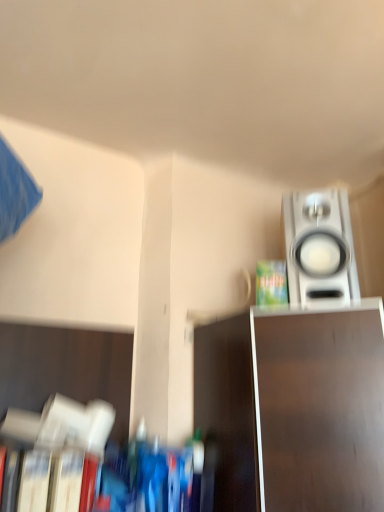
Question: Is green matte paperback book at upper right shorter than metallic silver tv stand at lower right?

Choices:
 (A) yes
 (B) no

Answer: (A)

Question: Is green matte paperback book at upper right taller than metallic silver tv stand at lower right?

Choices:
 (A) no
 (B) yes

Answer: (A)

Question: Is green matte paperback book at upper right not close to metallic silver tv stand at lower right?

Choices:
 (A) yes
 (B) no

Answer: (B)

Question: Is green matte paperback book at upper right closer to camera compared to metallic silver tv stand at lower right?

Choices:
 (A) no
 (B) yes

Answer: (A)

Question: Does green matte paperback book at upper right have a larger size compared to metallic silver tv stand at lower right?

Choices:
 (A) no
 (B) yes

Answer: (A)

Question: From a real-world perspective, is green matte paperback book at upper right over metallic silver tv stand at lower right?

Choices:
 (A) yes
 (B) no

Answer: (A)

Question: Considering the relative positions of hardcover book at lower left and satin silver speaker at upper right in the image provided, is hardcover book at lower left behind satin silver speaker at upper right?

Choices:
 (A) no
 (B) yes

Answer: (A)

Question: Is the surface of hardcover book at lower left in direct contact with satin silver speaker at upper right?

Choices:
 (A) yes
 (B) no

Answer: (B)

Question: Considering the relative positions of hardcover book at lower left and satin silver speaker at upper right in the image provided, is hardcover book at lower left to the left of satin silver speaker at upper right from the viewer's perspective?

Choices:
 (A) no
 (B) yes

Answer: (B)

Question: Could you tell me if hardcover book at lower left is facing satin silver speaker at upper right?

Choices:
 (A) no
 (B) yes

Answer: (A)

Question: Is satin silver speaker at upper right at the back of hardcover book at lower left?

Choices:
 (A) yes
 (B) no

Answer: (B)

Question: From a real-world perspective, is hardcover book at lower left physically above satin silver speaker at upper right?

Choices:
 (A) yes
 (B) no

Answer: (B)

Question: Can you confirm if satin silver speaker at upper right is positioned to the right of hardcover book at lower left?

Choices:
 (A) no
 (B) yes

Answer: (B)